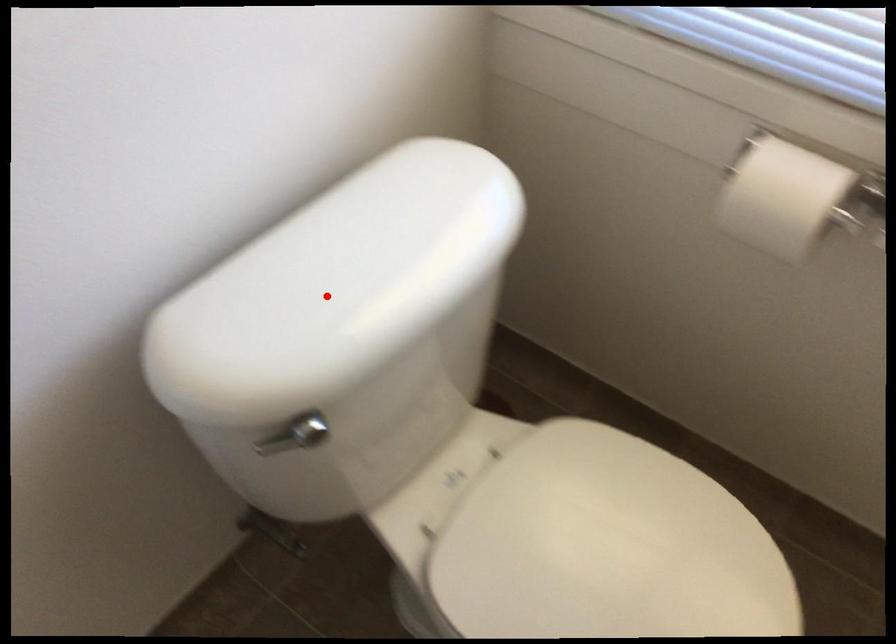
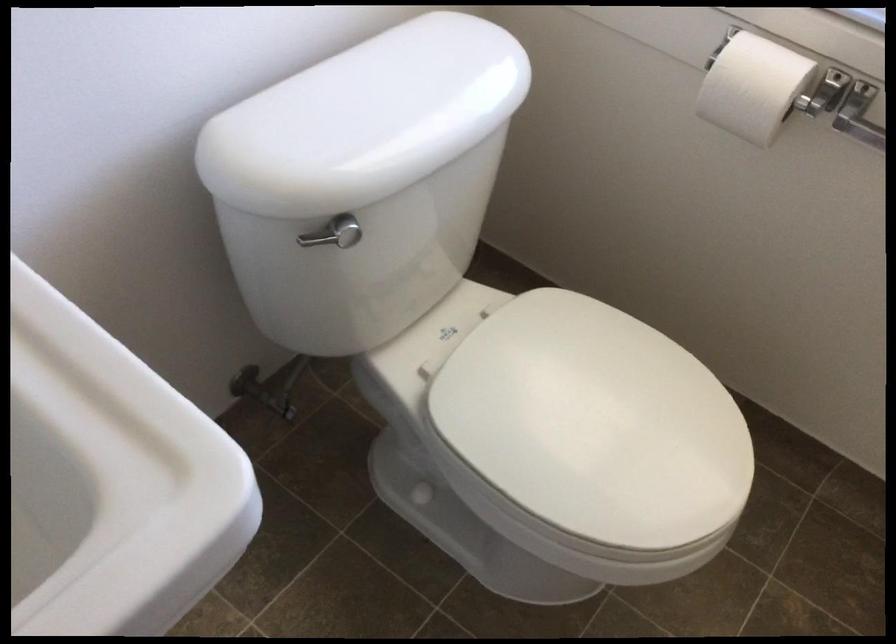
In the second image, find the point that corresponds to the highlighted location in the first image.

(365, 118)